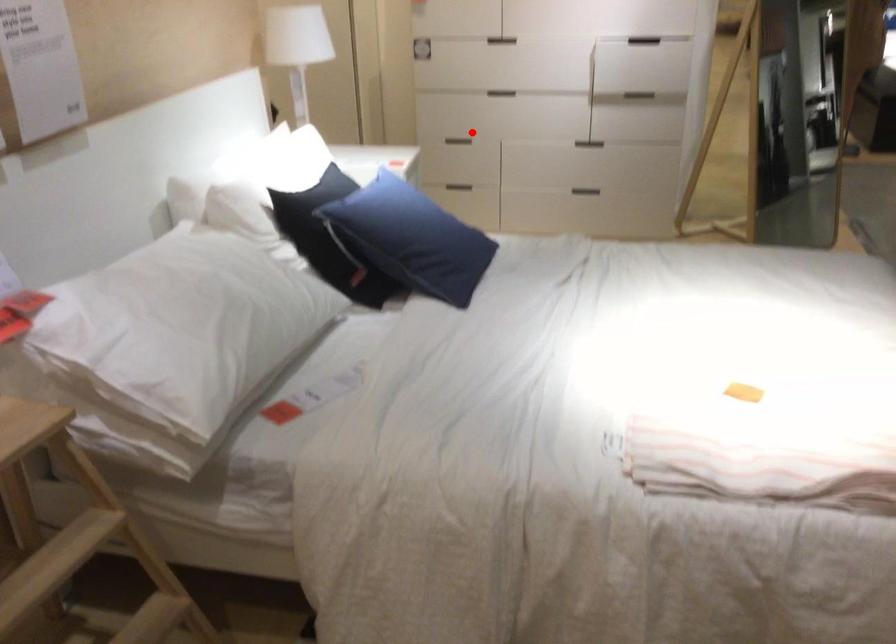
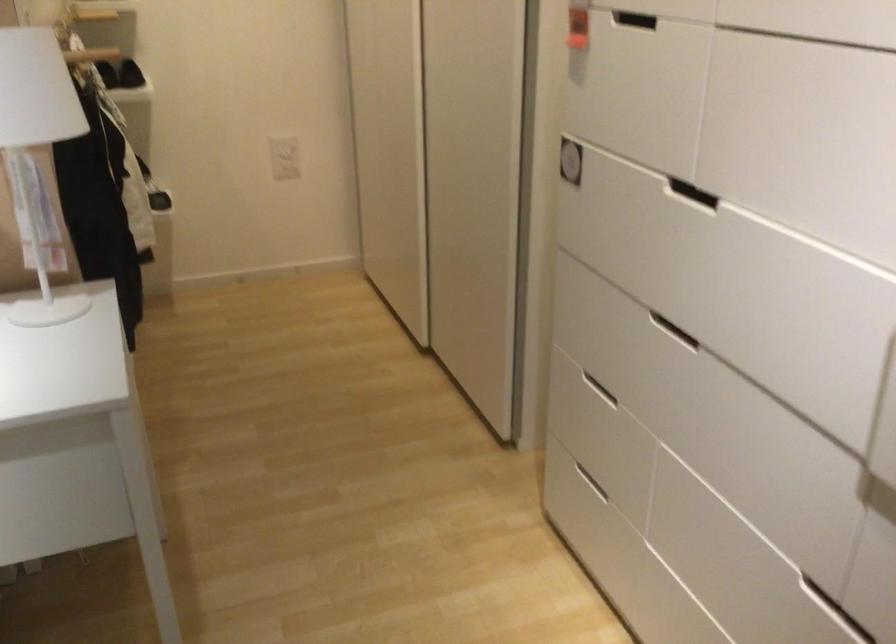
Question: I am providing you with two images of the same scene from different viewpoints. In image1, a red point is highlighted. Considering the same 3D point in image2, which of the following is correct?

Choices:
 (A) It is closer
 (B) It is farther

Answer: (A)